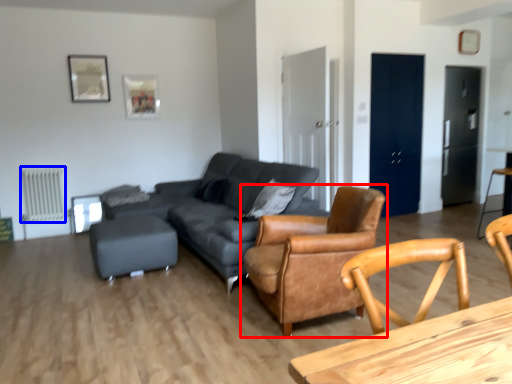
Question: Which object appears closest to the camera in this image, chair (highlighted by a red box) or radiator (highlighted by a blue box)?

Choices:
 (A) chair
 (B) radiator

Answer: (A)